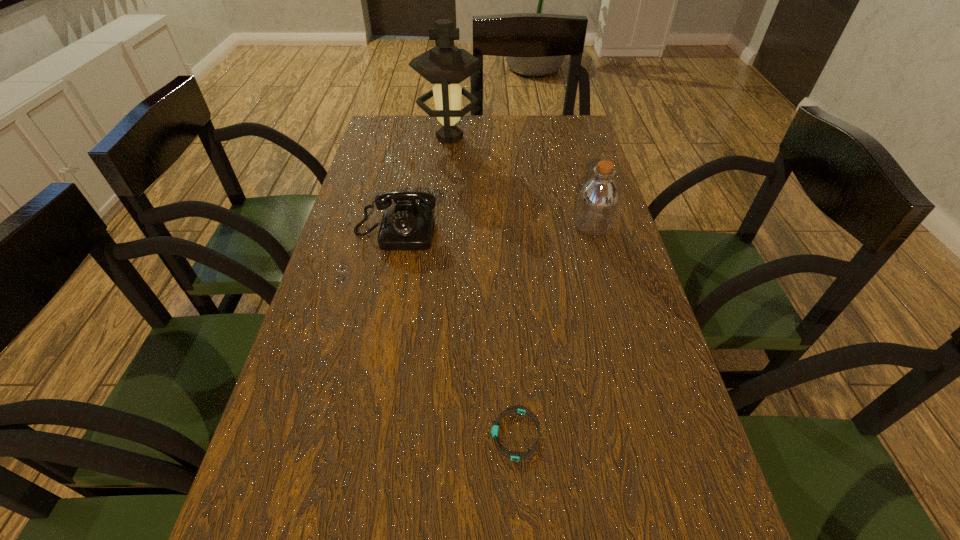
This screenshot has width=960, height=540. I want to click on vacant space at the right edge, so click(x=583, y=291).

This screenshot has width=960, height=540. I want to click on vacant region at the far left corner, so click(x=402, y=148).

I want to click on free space at the far right corner of the desktop, so click(x=553, y=119).

Identify the location of vacant area that lies between the third tallest object and the wristband. (455, 334).

Locate an element on the screen. This screenshot has width=960, height=540. free space that is in between the farthest object and the shortest object is located at coordinates (483, 287).

Identify the location of free spot between the second shortest object and the wristband. This screenshot has height=540, width=960. (455, 334).

The width and height of the screenshot is (960, 540). Find the location of `free space between the bottle and the tallest object`. free space between the bottle and the tallest object is located at coordinates (521, 182).

This screenshot has width=960, height=540. Find the location of `free spot between the shortest object and the bottle`. free spot between the shortest object and the bottle is located at coordinates (554, 330).

You are a GUI agent. You are given a task and a screenshot of the screen. Output one action in this format:
    pyautogui.click(x=<x>, y=<y>)
    Task: Click on the blank region between the telephone and the tallest object
    
    Given the screenshot: What is the action you would take?
    pyautogui.click(x=422, y=185)

Where is `free area in between the tallest object and the bottle`? free area in between the tallest object and the bottle is located at coordinates (521, 182).